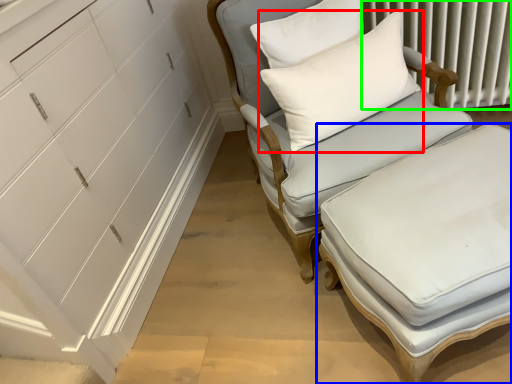
Question: Which object is positioned farthest from pillow (highlighted by a red box)? Select from table (highlighted by a blue box) and radiator (highlighted by a green box).

Choices:
 (A) table
 (B) radiator

Answer: (B)